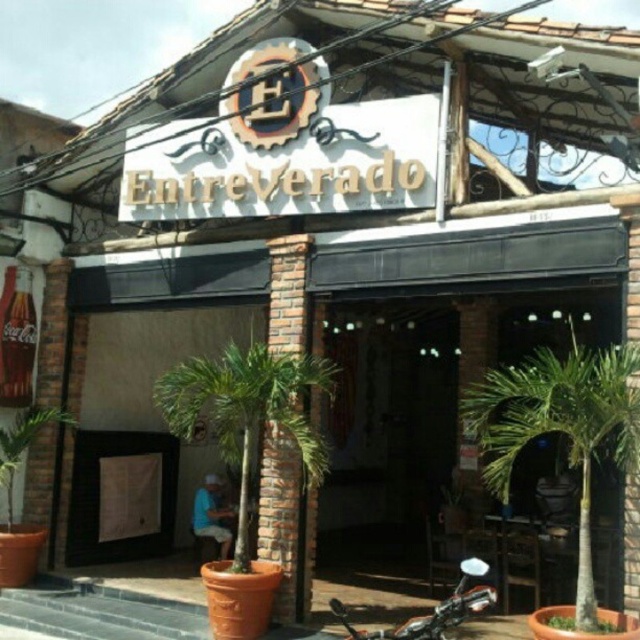
You are standing at the entrance of EntreVerado and want to park your motorcycle exactly 4 feet away from the green leafy palm tree at right. Can you park the shiny chrome motorcycle at lower center in its current position?

The green leafy palm tree at right is 3.58 feet away from the shiny chrome motorcycle at lower center, so yes, the motorcycle is already parked within the desired distance of 4 feet from the palm tree.

You are standing at the entrance of EntreVerado and want to find the palm tree that is closer to the ground. Which one is it between the green leafy palm tree at right and the green leafy palm tree at center?

The green leafy palm tree at right is located below the green leafy palm tree at center, so it is closer to the ground.